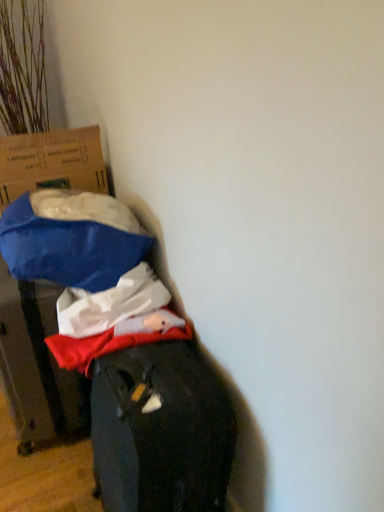
Question: From the image's perspective, is blue fabric bag at left, the 2th cardboard box when ordered from top to bottom, located above or below blue cardboard box at left, arranged as the second cardboard box when ordered from the bottom?

Choices:
 (A) above
 (B) below

Answer: (B)

Question: From a real-world perspective, relative to blue cardboard box at left, arranged as the second cardboard box when ordered from the bottom, is blue fabric bag at left, the 2th cardboard box when ordered from top to bottom, vertically above or below?

Choices:
 (A) above
 (B) below

Answer: (B)

Question: Is blue fabric bag at left, the 1th cardboard box positioned from the bottom, spatially inside blue cardboard box at left, arranged as the second cardboard box when ordered from the bottom, or outside of it?

Choices:
 (A) inside
 (B) outside

Answer: (B)

Question: Considering their positions, is blue cardboard box at left, arranged as the second cardboard box when ordered from the bottom, located in front of or behind blue fabric bag at left, the 2th cardboard box when ordered from top to bottom?

Choices:
 (A) behind
 (B) front

Answer: (A)

Question: Is blue cardboard box at left, the first cardboard box when ordered from top to bottom, wider or thinner than blue fabric bag at left, the 2th cardboard box when ordered from top to bottom?

Choices:
 (A) wide
 (B) thin

Answer: (B)

Question: From a real-world perspective, is blue cardboard box at left, arranged as the second cardboard box when ordered from the bottom, positioned above or below blue fabric bag at left, the 1th cardboard box positioned from the bottom?

Choices:
 (A) below
 (B) above

Answer: (B)

Question: Is blue cardboard box at left, the first cardboard box when ordered from top to bottom, taller or shorter than blue fabric bag at left, the 2th cardboard box when ordered from top to bottom?

Choices:
 (A) tall
 (B) short

Answer: (B)